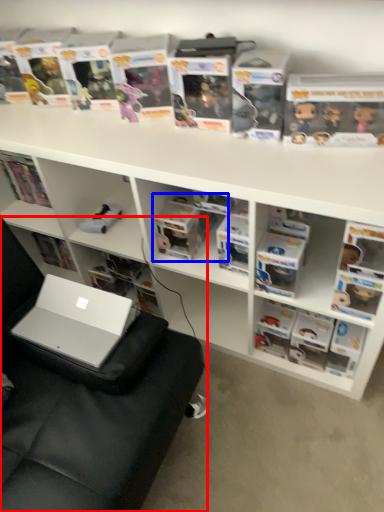
Question: Which object appears farthest to the camera in this image, swivel chair (highlighted by a red box) or book (highlighted by a blue box)?

Choices:
 (A) swivel chair
 (B) book

Answer: (B)